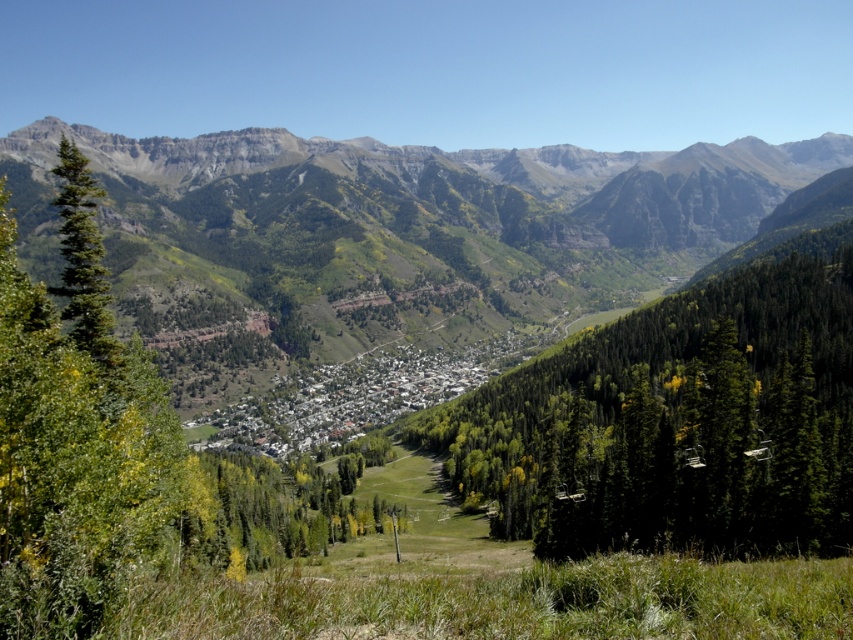
Can you confirm if green forested mountain range at center is positioned below green textured tree at center?

No.

Does green forested mountain range at center have a larger size compared to green textured tree at center?

Indeed, green forested mountain range at center has a larger size compared to green textured tree at center.

Locate an element on the screen. green forested mountain range at center is located at coordinates (386, 236).

Identify the location of green forested mountain range at center. (386, 236).

Who is higher up, green textured tree at center or green leafy tree at left?

green textured tree at center

Is point (625, 422) less distant than point (233, 554)?

That is False.

Identify the location of green textured tree at center. The image size is (853, 640). (672, 424).

In the scene shown: Is green forested mountain range at center thinner than green leafy tree at left?

In fact, green forested mountain range at center might be wider than green leafy tree at left.

Is green forested mountain range at center to the left of green leafy tree at left from the viewer's perspective?

No, green forested mountain range at center is not to the left of green leafy tree at left.

Does point (734, 161) come closer to viewer compared to point (148, 385)?

No, (734, 161) is further to viewer.

At what (x,y) coordinates should I click in order to perform the action: click on green forested mountain range at center. Please return your answer as a coordinate pair (x, y). The height and width of the screenshot is (640, 853). Looking at the image, I should click on (386, 236).